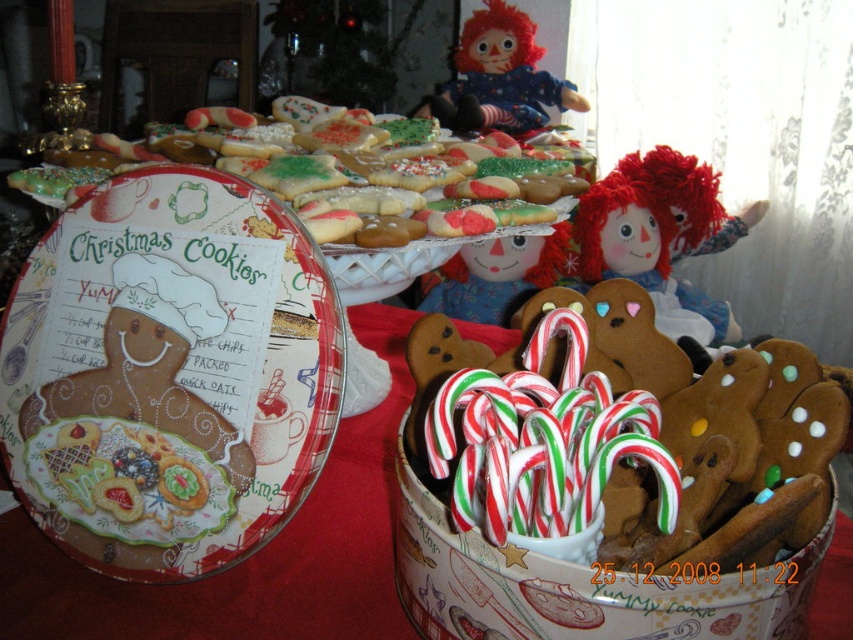
You are looking at the festive holiday scene with the two points marked in the image. Which point is closer to you, point at coordinate (584, 280) or point at coordinate (467, 115)?

Point at coordinate (584, 280) is closer to you than point at coordinate (467, 115).

Where is the glazed sugar cookies at upper center located in the image?

The glazed sugar cookies at upper center is located at point (341, 172).